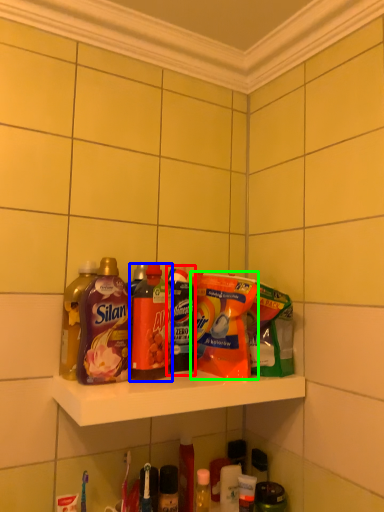
Question: Which is farther away from bottle (highlighted by a red box)? bottle (highlighted by a blue box) or cleaning product (highlighted by a green box)?

Choices:
 (A) bottle
 (B) cleaning product

Answer: (B)